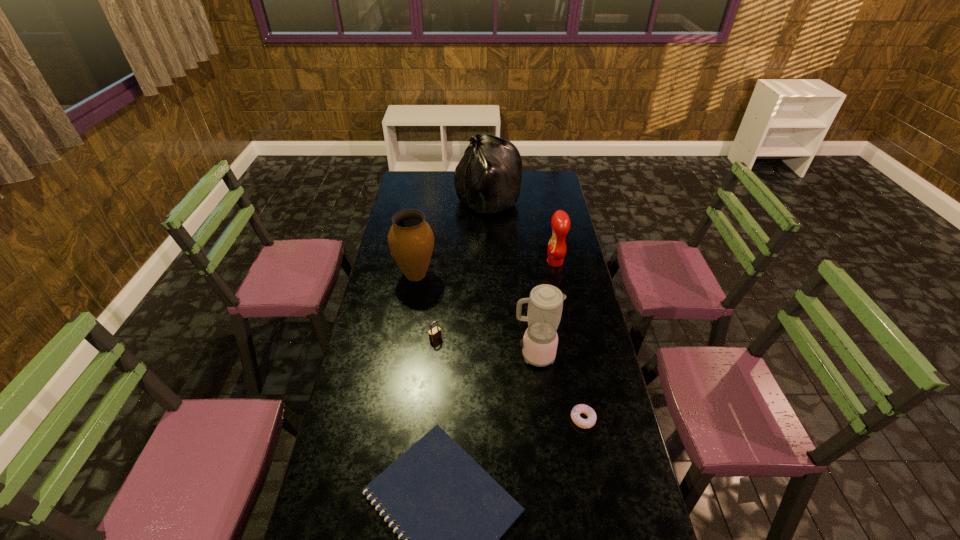
Find the location of a particular element. This screenshot has height=540, width=960. free region located on the base of the food processor near the control knob is located at coordinates (452, 355).

Locate an element on the screen. free location located 0.190m on the front of the urn is located at coordinates (408, 323).

Where is `free space located on the label side of the condiment`? free space located on the label side of the condiment is located at coordinates (495, 262).

You are a GUI agent. You are given a task and a screenshot of the screen. Output one action in this format:
    pyautogui.click(x=<x>, y=<y>)
    Task: Click on the free location located 0.170m on the label side of the condiment
    Image resolution: width=960 pixels, height=540 pixels.
    Given the screenshot: What is the action you would take?
    pyautogui.click(x=509, y=262)

This screenshot has width=960, height=540. Identify the location of free location located 0.200m on the label side of the condiment. (502, 262).

The width and height of the screenshot is (960, 540). What are the coordinates of `vacant region located 0.050m on the front of the padlock` in the screenshot? It's located at (434, 353).

The image size is (960, 540). What are the coordinates of `free space located on the front of the doughnut` in the screenshot? It's located at (589, 455).

This screenshot has height=540, width=960. I want to click on object at the far edge, so pyautogui.click(x=488, y=177).

Locate an element on the screen. The image size is (960, 540). object located in the left edge section of the desktop is located at coordinates (411, 240).

Locate an element on the screen. This screenshot has width=960, height=540. condiment at the right edge is located at coordinates (560, 222).